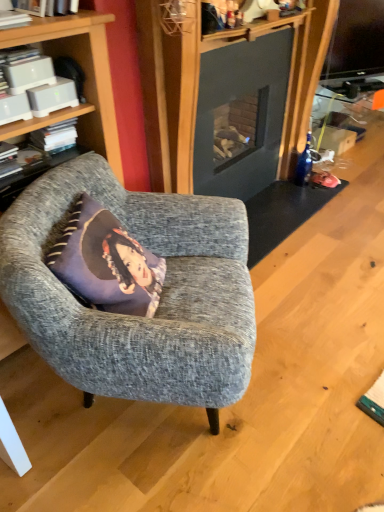
Where is `vacant area on top of dark gray fabric cushion at left (from a real-world perspective)`? The width and height of the screenshot is (384, 512). vacant area on top of dark gray fabric cushion at left (from a real-world perspective) is located at coordinates (33, 155).